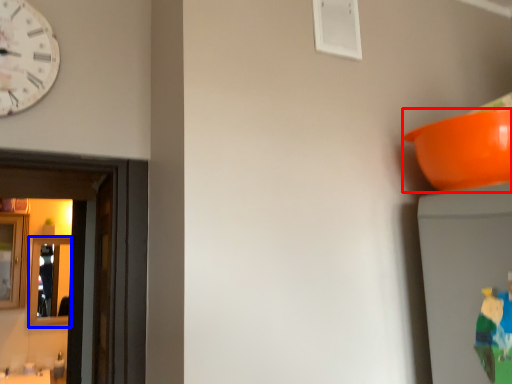
Question: Among these objects, which one is farthest to the camera, bowl (highlighted by a red box) or mirror (highlighted by a blue box)?

Choices:
 (A) bowl
 (B) mirror

Answer: (B)